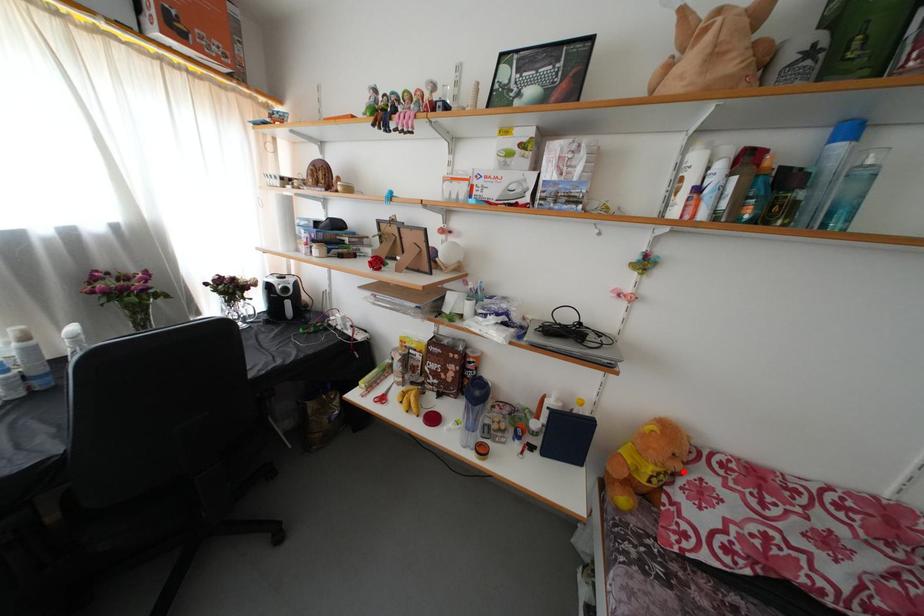
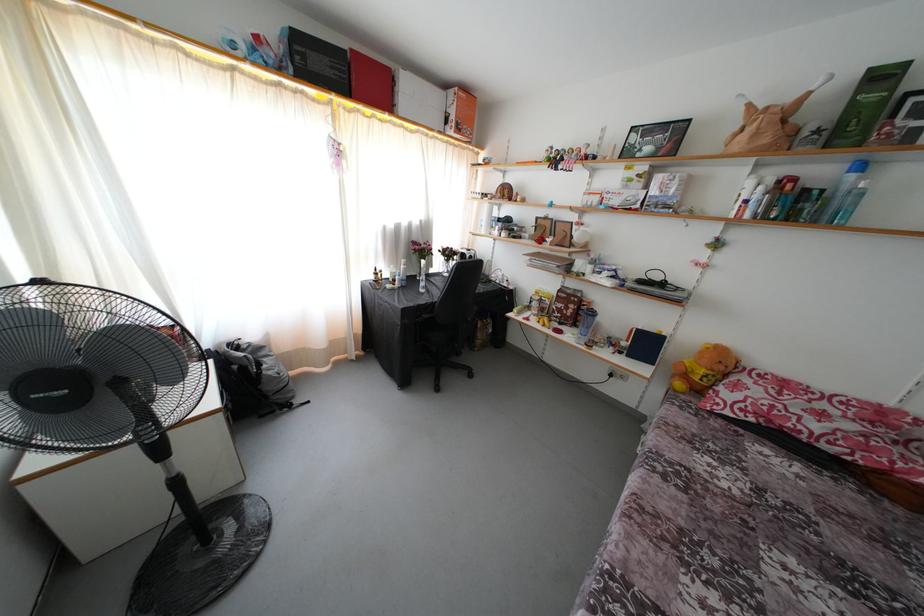
Find the pixel in the second image that matches the highlighted location in the first image.

(726, 373)